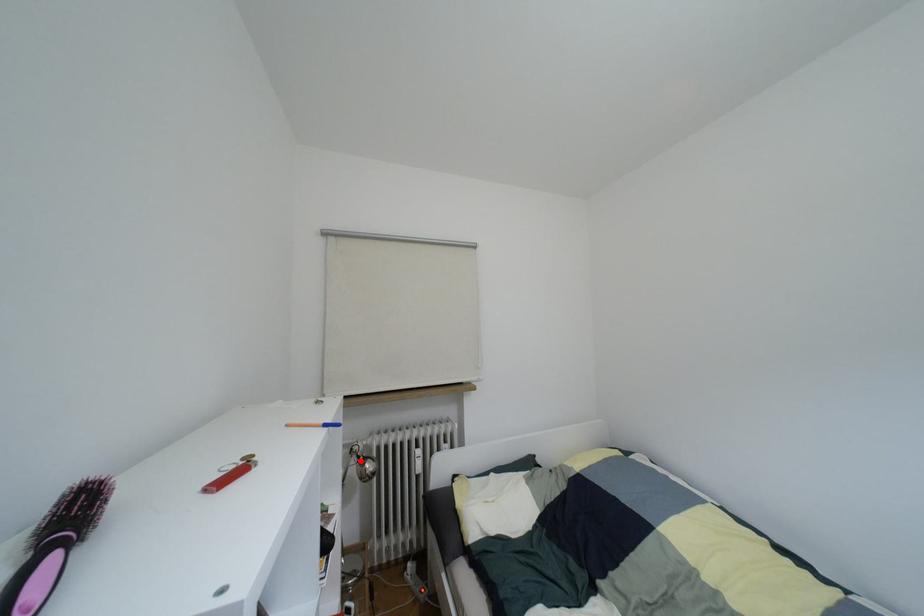
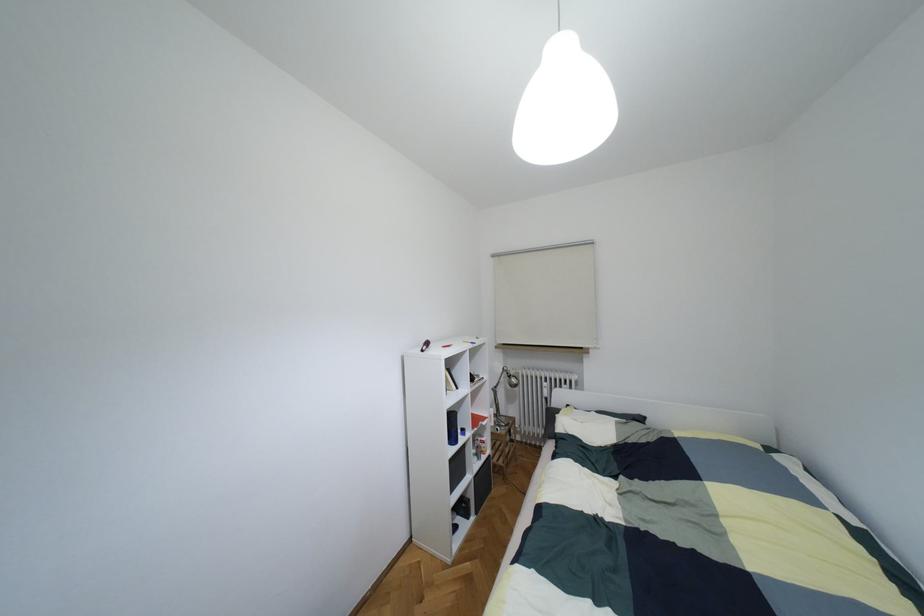
Question: I am providing you with two images of the same scene from different viewpoints. Given a red point in image1, look at the same physical point in image2. Is it:

Choices:
 (A) Closer to the viewpoint
 (B) Farther from the viewpoint

Answer: (B)